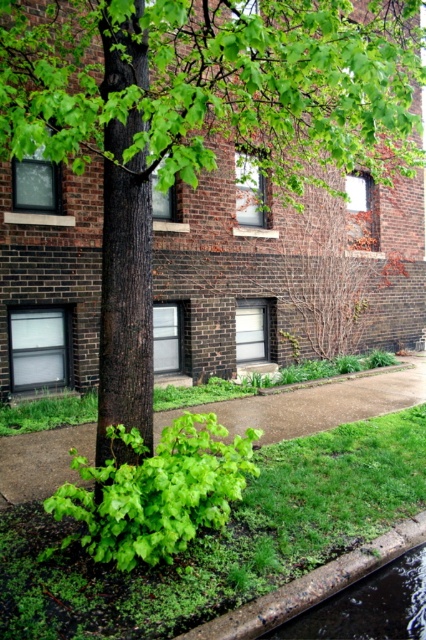
You are standing on the sidewalk and looking at the green leafy grass at lower center and the green grass at lower center. Which one is nearer to you?

The green leafy grass at lower center is closer to the viewer than the green grass at lower center.

You are standing on the sidewalk looking at the brick building and the tree. There are two points marked on the image. Which point, point (313, 484) or point (163, 412), is closer to you?

Point (313, 484) is closer to the viewer than point (163, 412).

You are a gardener who needs to mow the lawn. You see the green leafy grass at lower center and the green grass at lower center. Which one should you mow first to ensure proper lawn maintenance?

The green leafy grass at lower center should be mowed first because it is much taller than the green grass at lower center, ensuring even growth and maintenance.